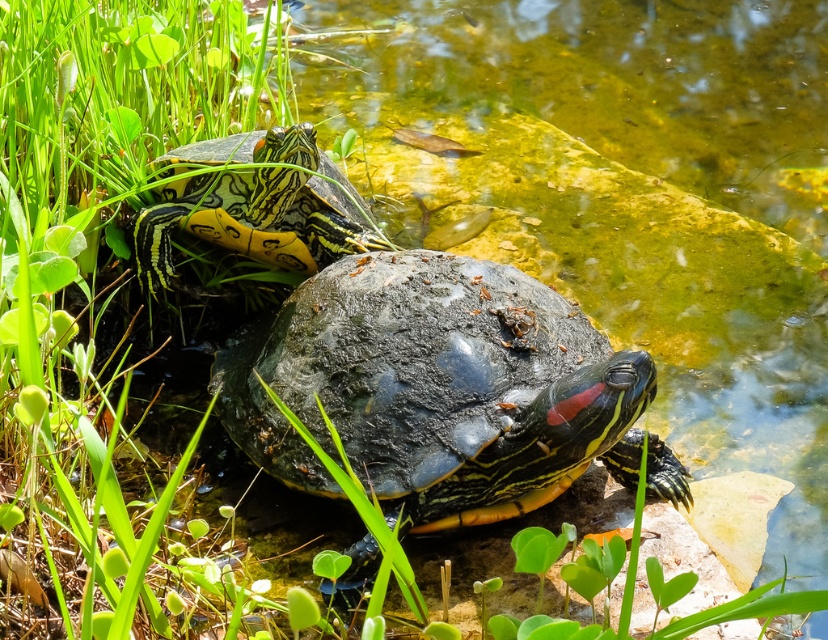
Between point (388, 451) and point (253, 154), which one is positioned behind?

Point (253, 154)

Is shiny black tortoise at center below yellow-green painted shell at upper left?

Yes.

Where is `shiny black tortoise at center`? shiny black tortoise at center is located at coordinates (436, 387).